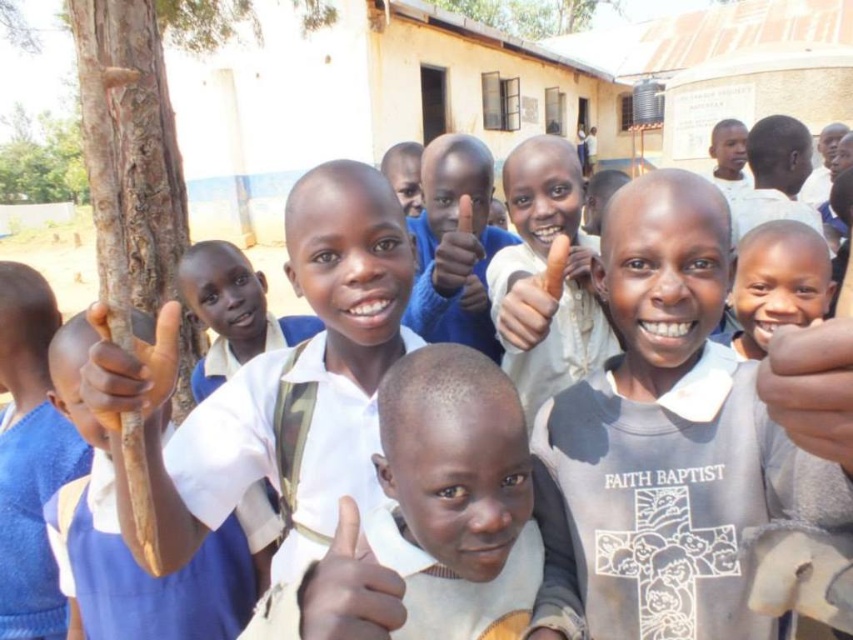
Question: Is smooth skin boy at center further to camera compared to white matte hand at center?

Choices:
 (A) no
 (B) yes

Answer: (B)

Question: Which of the following is the farthest from the observer?

Choices:
 (A) (459, 326)
 (B) (786, 342)

Answer: (A)

Question: Which point appears closest to the camera in this image?

Choices:
 (A) (341, 636)
 (B) (517, 426)
 (C) (463, 241)
 (D) (641, 609)

Answer: (A)

Question: Can you confirm if smooth white shirt at center is positioned below brown rough stick at left?

Choices:
 (A) no
 (B) yes

Answer: (B)

Question: Is white matte shirt at center positioned in front of brown rough stick at left?

Choices:
 (A) yes
 (B) no

Answer: (A)

Question: Which object is positioned closest to the smooth white shirt at center?

Choices:
 (A) dark skin hand at center
 (B) white matte hand at center
 (C) smooth skin hand at center
 (D) blue fabric shirt at left

Answer: (B)